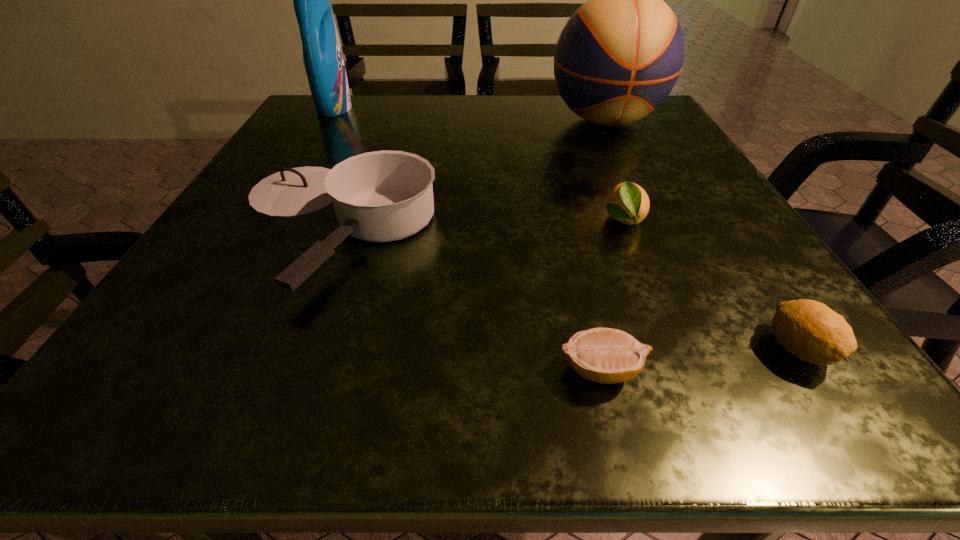
The height and width of the screenshot is (540, 960). Identify the location of free point located with leaves positioned above the second lemon from left to right. (656, 305).

The height and width of the screenshot is (540, 960). I want to click on vacant space located on the left of the leftmost lemon, so click(x=472, y=370).

Identify the location of detergent that is at the far edge. The image size is (960, 540). (322, 55).

This screenshot has width=960, height=540. Find the location of `basketball that is at the far edge`. basketball that is at the far edge is located at coordinates (618, 57).

Find the location of a particular element. detergent at the left edge is located at coordinates (322, 55).

I want to click on saucepan positioned at the left edge, so click(382, 196).

Where is `basketball present at the right edge`? The image size is (960, 540). basketball present at the right edge is located at coordinates (618, 57).

Locate an element on the screen. object that is at the far left corner is located at coordinates (322, 55).

The height and width of the screenshot is (540, 960). Identify the location of object located in the far right corner section of the desktop. (618, 57).

Identify the location of object present at the near right corner. The height and width of the screenshot is (540, 960). (810, 330).